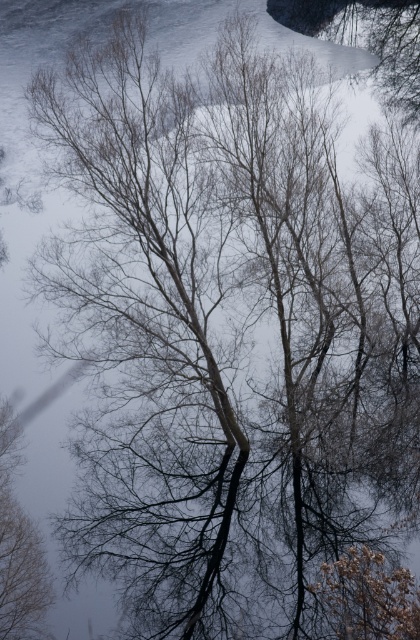
You are standing in the winter scene and want to reach both points mentioned. Which point is closer to you, point [340,611] or point [5,621]?

Point [340,611] is closer to you than point [5,621].

You are a photographer standing at the camera position. You want to take a closeup shot of the brown textured tree at lower right. Given that your camera has a maximum zoom range of 20 meters, can you capture the tree without moving closer?

The brown textured tree at lower right is 22.41 meters from camera, which exceeds the camera maximum zoom range of 20 meters. Therefore, you cannot capture the tree without moving closer.

You are an observer standing in the winter scene. You notice the brown textured tree at lower right and the brown matte tree at left. Which tree appears taller from your viewpoint?

The brown matte tree at left is taller than the brown textured tree at lower right.